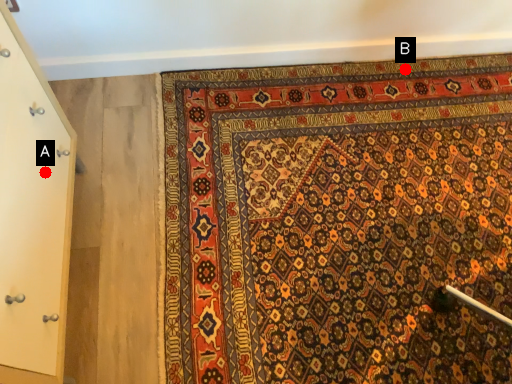
Question: Two points are circled on the image, labeled by A and B beside each circle. Which point is farther to the camera?

Choices:
 (A) A is further
 (B) B is further

Answer: (B)